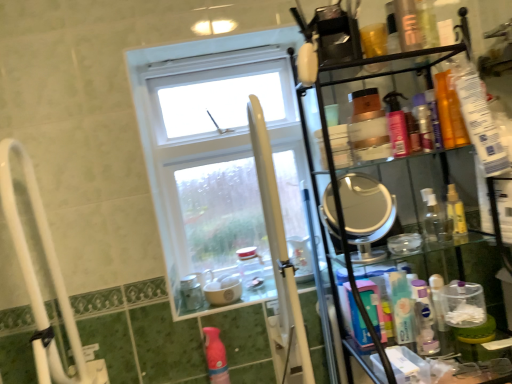
Where is `white plastic pole at center`? white plastic pole at center is located at coordinates (277, 237).

Image resolution: width=512 pixels, height=384 pixels. Identify the location of clear plastic bottle at right, marked as the 3th mouthwash in a top-to-bottom arrangement. (456, 212).

Identify the location of translucent plastic bottle at upper right, the second toiletry when ordered from front to back. (434, 119).

Image resolution: width=512 pixels, height=384 pixels. Identify the location of white matte mouthwash at right, arranged as the second mouthwash when ordered from the bottom. (401, 306).

What are the coordinates of `clear glass jar at center, the second bottle in the front-to-back sequence` in the screenshot? It's located at (250, 267).

Measure the distance between blue plastic mouthwash at right, the 5th mouthwash viewed from the top, and camera.

The depth of blue plastic mouthwash at right, the 5th mouthwash viewed from the top, is 37.85 inches.

The image size is (512, 384). Find the location of `white plastic pole at center`. white plastic pole at center is located at coordinates (277, 237).

Is metallic silver jar at lower center, which is the 2th bottle from back to front, not near pink glossy mouthwash at upper right, the 2th mouthwash in the left-to-right sequence?

They are positioned close to each other.

Would you say metallic silver jar at lower center, the first bottle when ordered from left to right, is to the left or to the right of pink glossy mouthwash at upper right, which appears as the 4th mouthwash when viewed from the right, in the picture?

Based on their positions, metallic silver jar at lower center, the first bottle when ordered from left to right, is located to the left of pink glossy mouthwash at upper right, which appears as the 4th mouthwash when viewed from the right.

Could you measure the distance between metallic silver jar at lower center, the first bottle when ordered from front to back, and pink glossy mouthwash at upper right, which appears as the 4th mouthwash when viewed from the right?

The distance of metallic silver jar at lower center, the first bottle when ordered from front to back, from pink glossy mouthwash at upper right, which appears as the 4th mouthwash when viewed from the right, is 32.67 inches.

Does point (192, 281) lie behind point (404, 124)?

Yes, it is.

Can you tell me how much translucent plastic bottle at upper right, the second toiletry when ordered from front to back, and pink matte bottle at lower center differ in facing direction?

7.31 degrees separate the facing orientations of translucent plastic bottle at upper right, the second toiletry when ordered from front to back, and pink matte bottle at lower center.

Is translucent plastic bottle at upper right, acting as the first toiletry starting from the back, not close to pink matte bottle at lower center?

They are positioned close to each other.

Which object is positioned more to the right, translucent plastic bottle at upper right, acting as the first toiletry starting from the back, or pink matte bottle at lower center?

translucent plastic bottle at upper right, acting as the first toiletry starting from the back.

Does translucent plastic bottle at upper right, acting as the first toiletry starting from the back, lie behind pink matte bottle at lower center?

No.

Which is correct: pink matte bottle at lower center is inside pink glossy mouthwash at upper right, which appears as the 4th mouthwash when viewed from the right, or outside of it?

pink matte bottle at lower center is located beyond the bounds of pink glossy mouthwash at upper right, which appears as the 4th mouthwash when viewed from the right.

Is pink matte bottle at lower center positioned before pink glossy mouthwash at upper right, which is the second mouthwash from top to bottom?

No.

Is pink matte bottle at lower center facing away from pink glossy mouthwash at upper right, which is the second mouthwash from top to bottom?

pink matte bottle at lower center does not have its back to pink glossy mouthwash at upper right, which is the second mouthwash from top to bottom.

Based on the photo, considering the sizes of pink matte bottle at lower center and pink glossy mouthwash at upper right, arranged as the 4th mouthwash when ordered from the bottom, in the image, is pink matte bottle at lower center taller or shorter than pink glossy mouthwash at upper right, arranged as the 4th mouthwash when ordered from the bottom,?

In the image, pink matte bottle at lower center appears to be taller than pink glossy mouthwash at upper right, arranged as the 4th mouthwash when ordered from the bottom.

Is there a large distance between pink glossy mouthwash at upper right, arranged as the 4th mouthwash when ordered from the bottom, and shiny orange bottle at upper right, the 1th toiletry from the front?

They are positioned close to each other.

Who is taller, pink glossy mouthwash at upper right, which is the second mouthwash from top to bottom, or shiny orange bottle at upper right, the 1th toiletry from the front?

shiny orange bottle at upper right, the 1th toiletry from the front, is taller.

From the picture: Is metallic silver jar at lower center, which ranks as the 2th bottle in right-to-left order, in contact with translucent orange bottle at upper right, the fifth mouthwash positioned from the bottom?

No, metallic silver jar at lower center, which ranks as the 2th bottle in right-to-left order, is not next to translucent orange bottle at upper right, the fifth mouthwash positioned from the bottom.

Considering the sizes of objects metallic silver jar at lower center, which is the 2th bottle from back to front, and translucent orange bottle at upper right, the fifth mouthwash positioned from the bottom, in the image provided, who is taller, metallic silver jar at lower center, which is the 2th bottle from back to front, or translucent orange bottle at upper right, the fifth mouthwash positioned from the bottom,?

With more height is translucent orange bottle at upper right, the fifth mouthwash positioned from the bottom.

From the image's perspective, between metallic silver jar at lower center, the first bottle when ordered from front to back, and translucent orange bottle at upper right, the fifth mouthwash positioned from the bottom, who is located below?

metallic silver jar at lower center, the first bottle when ordered from front to back, is shown below in the image.

Which object is positioned more to the right, metallic silver jar at lower center, which is the 2th bottle from back to front, or translucent orange bottle at upper right, positioned as the first mouthwash in top-to-bottom order?

translucent orange bottle at upper right, positioned as the first mouthwash in top-to-bottom order.

Could you tell me if white plastic pole at center is facing translucent orange bottle at upper right, marked as the 2th mouthwash in a right-to-left arrangement?

No, white plastic pole at center does not turn towards translucent orange bottle at upper right, marked as the 2th mouthwash in a right-to-left arrangement.

Which object is positioned more to the right, white plastic pole at center or translucent orange bottle at upper right, positioned as the first mouthwash in top-to-bottom order?

Positioned to the right is translucent orange bottle at upper right, positioned as the first mouthwash in top-to-bottom order.

Is white plastic pole at center touching translucent orange bottle at upper right, marked as the 2th mouthwash in a right-to-left arrangement?

No, white plastic pole at center is not in contact with translucent orange bottle at upper right, marked as the 2th mouthwash in a right-to-left arrangement.

This screenshot has width=512, height=384. In order to click on pole below the translucent orange bottle at upper right, marked as the 2th mouthwash in a right-to-left arrangement (from a real-world perspective) in this screenshot , I will do `click(277, 237)`.

Can you confirm if clear plastic bottle at right, marked as the 3th mouthwash in a top-to-bottom arrangement, is taller than pink matte bottle at lower center?

In fact, clear plastic bottle at right, marked as the 3th mouthwash in a top-to-bottom arrangement, may be shorter than pink matte bottle at lower center.

This screenshot has width=512, height=384. I want to click on the 5th mouthwash to the right of the pink matte bottle at lower center, starting your count from the anchor, so click(x=456, y=212).

Is clear plastic bottle at right, marked as the 3th mouthwash in a top-to-bottom arrangement, bigger than pink matte bottle at lower center?

Incorrect, clear plastic bottle at right, marked as the 3th mouthwash in a top-to-bottom arrangement, is not larger than pink matte bottle at lower center.

In the scene shown: Is clear plastic bottle at right, placed as the 1th mouthwash when sorted from right to left, next to pink matte bottle at lower center and touching it?

clear plastic bottle at right, placed as the 1th mouthwash when sorted from right to left, and pink matte bottle at lower center are not in contact.

From a real-world perspective, starting from the metallic silver jar at lower center, which is the 2th bottle from back to front, which mouthwash is the 2nd one vertically above it? Please provide its 2D coordinates.

[(397, 125)]

Which toiletry is the 1st one when counting from the right side of the pink matte bottle at lower center? Please provide its 2D coordinates.

[(434, 119)]

From the image, which object appears to be nearer to clear glass jar at center, the second bottle in the front-to-back sequence, clear plastic bottle at right, the fifth mouthwash from the left, or blue plastic mouthwash at right, the 1th mouthwash from the bottom?

blue plastic mouthwash at right, the 1th mouthwash from the bottom.

From the picture: Looking at the image, which one is located closer to clear glass jar at center, arranged as the first bottle when viewed from the right, shiny orange bottle at upper right, the 2th toiletry viewed from the back, or white glass window at center?

white glass window at center is closer to clear glass jar at center, arranged as the first bottle when viewed from the right.

Estimate the real-world distances between objects in this image. Which object is closer to blue plastic mouthwash at right, the 5th mouthwash viewed from the top, shiny orange bottle at upper right, the 2th toiletry viewed from the back, or pink matte bottle at lower center?

pink matte bottle at lower center is positioned closer to the anchor blue plastic mouthwash at right, the 5th mouthwash viewed from the top.

From the image, which object appears to be nearer to white glass window at center, shiny orange bottle at upper right, the 2th toiletry viewed from the back, or metallic silver jar at lower center, the first bottle when ordered from front to back?

Among the two, metallic silver jar at lower center, the first bottle when ordered from front to back, is located nearer to white glass window at center.

From the image, which object appears to be farther from pink glossy mouthwash at upper right, which is the second mouthwash from top to bottom, blue plastic mouthwash at right, arranged as the 1th mouthwash when viewed from the left, or white glass window at center?

Based on the image, white glass window at center appears to be further to pink glossy mouthwash at upper right, which is the second mouthwash from top to bottom.

Considering their positions, is translucent orange bottle at upper right, marked as the 2th mouthwash in a right-to-left arrangement, positioned further to blue plastic mouthwash at right, the 1th mouthwash from the bottom, than pink glossy mouthwash at upper right, the 2th mouthwash in the left-to-right sequence?

translucent orange bottle at upper right, marked as the 2th mouthwash in a right-to-left arrangement, is further to blue plastic mouthwash at right, the 1th mouthwash from the bottom.

Which object lies further to the anchor point pink matte bottle at lower center, white plastic pole at center or translucent plastic bottle at upper right, the second toiletry when ordered from front to back?

translucent plastic bottle at upper right, the second toiletry when ordered from front to back, is further to pink matte bottle at lower center.

When comparing their distances from shiny orange bottle at upper right, the 1th toiletry from the front, does blue plastic mouthwash at right, the 1th mouthwash from the bottom, or translucent plastic bottle at upper right, acting as the first toiletry starting from the back, seem closer?

translucent plastic bottle at upper right, acting as the first toiletry starting from the back, lies closer to shiny orange bottle at upper right, the 1th toiletry from the front, than the other object.

Locate an element on the screen. The width and height of the screenshot is (512, 384). window between metallic silver jar at lower center, which is the 2th bottle from back to front, and pink glossy mouthwash at upper right, the 2th mouthwash in the left-to-right sequence, in the horizontal direction is located at coordinates (217, 155).

The width and height of the screenshot is (512, 384). In order to click on toiletry located between metallic silver jar at lower center, the first bottle when ordered from front to back, and shiny orange bottle at upper right, the 2th toiletry viewed from the back, in the left-right direction in this screenshot , I will do `click(434, 119)`.

Locate an element on the screen. The width and height of the screenshot is (512, 384). toiletry between translucent orange bottle at upper right, the fifth mouthwash positioned from the bottom, and clear plastic bottle at right, placed as the 1th mouthwash when sorted from right to left, from top to bottom is located at coordinates (434, 119).

Where is `bottle between translucent plastic bottle at upper right, the second toiletry when ordered from front to back, and white matte mouthwash at right, which appears as the third mouthwash when viewed from the right, in the vertical direction`? This screenshot has width=512, height=384. bottle between translucent plastic bottle at upper right, the second toiletry when ordered from front to back, and white matte mouthwash at right, which appears as the third mouthwash when viewed from the right, in the vertical direction is located at coordinates (250, 267).